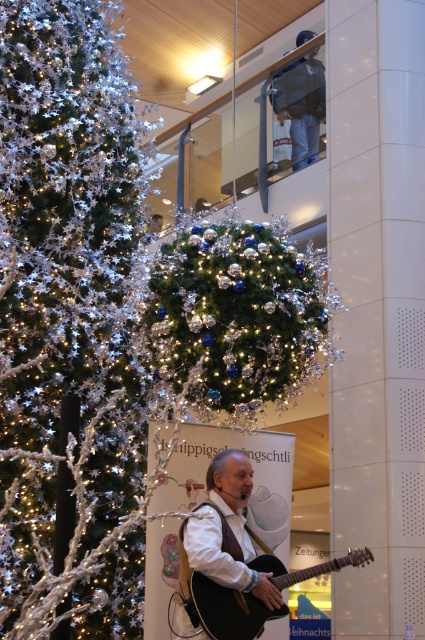
Is point (180, 630) positioned behind point (243, 621)?

Yes, point (180, 630) is farther from viewer.

Is point (207, 557) positioned before point (246, 628)?

Yes, it is in front of point (246, 628).

Image resolution: width=425 pixels, height=640 pixels. Identify the location of white matte guitar at center. (224, 532).

Between point (277, 342) and point (227, 564), which one is positioned behind?

The point (277, 342) is more distant.

Does shiny silver ornaments at center appear on the right side of white matte guitar at center?

Correct, you'll find shiny silver ornaments at center to the right of white matte guitar at center.

This screenshot has width=425, height=640. Describe the element at coordinates (238, 316) in the screenshot. I see `shiny silver ornaments at center` at that location.

In order to click on shiny silver ornaments at center in this screenshot , I will do `click(238, 316)`.

Does shiny silver ornaments at center lie behind matte black guitar at center?

Yes, shiny silver ornaments at center is further from the viewer.

Locate an element on the screen. Image resolution: width=425 pixels, height=640 pixels. shiny silver ornaments at center is located at coordinates (238, 316).

What do you see at coordinates (238, 316) in the screenshot?
I see `shiny silver ornaments at center` at bounding box center [238, 316].

Image resolution: width=425 pixels, height=640 pixels. I want to click on shiny silver ornaments at center, so click(x=238, y=316).